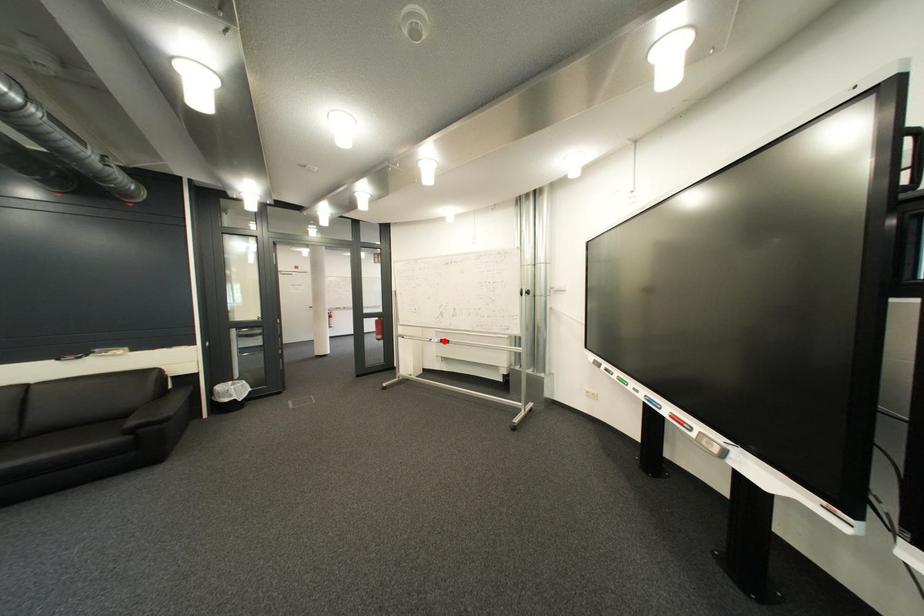
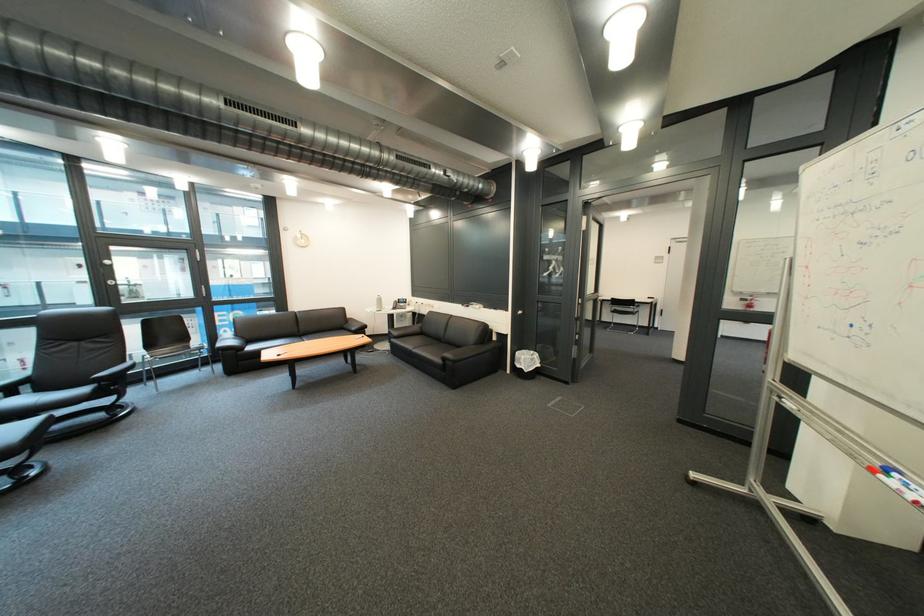
Question: I am providing you with two images of the same scene from different viewpoints. A red point is shown in image1. For the corresponding object point in image2, is it positioned nearer or farther from the camera?

Choices:
 (A) Nearer
 (B) Farther

Answer: (B)